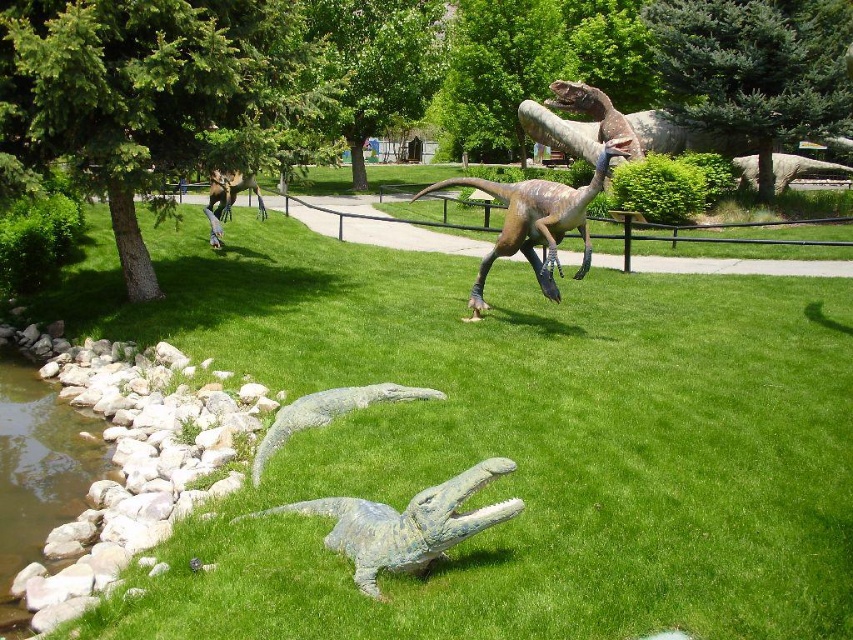
You are a park visitor standing at the entrance and see the shiny brown dinosaur at upper center and the shiny metallic dinosaur at upper left. Which one is positioned higher up in the image?

The shiny brown dinosaur at upper center is positioned higher up in the image than the shiny metallic dinosaur at upper left.

You are a park visitor who wants to take a photo of the shiny brown dinosaur at upper center without the green grass at lower left in the frame. Is it possible to do so?

The green grass at lower left is bigger than the shiny brown dinosaur at upper center, so it might block the view. However, since the grass is at the lower left and the dinosaur is at the upper center, you can adjust your camera angle or position to exclude the grass from the frame by moving closer to the dinosaur or tilting the camera upwards.

From the picture: You are standing in the park and want to take a photo of both point (312, 561) and point (596, 93) in the image. Which point should you focus on first to ensure both are in the frame?

You should focus on point (312, 561) first because it is closer to you than point (596, 93), allowing both points to be captured within the frame.